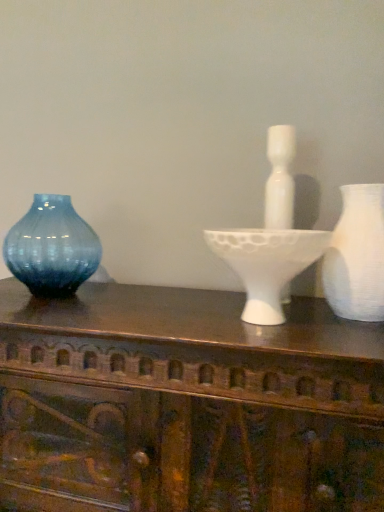
Question: Considering the relative sizes of white matte vase at right, which is counted as the 2th vase, starting from the left, and white matte candle holder at center in the image provided, is white matte vase at right, which is counted as the 2th vase, starting from the left, taller than white matte candle holder at center?

Choices:
 (A) no
 (B) yes

Answer: (B)

Question: Is white matte vase at right, the first vase when ordered from right to left, positioned beyond the bounds of white matte candle holder at center?

Choices:
 (A) yes
 (B) no

Answer: (A)

Question: Is white matte vase at right, the first vase when ordered from right to left, bigger than white matte candle holder at center?

Choices:
 (A) no
 (B) yes

Answer: (A)

Question: Is white matte vase at right, which ranks as the first vase in front-to-back order, shorter than white matte candle holder at center?

Choices:
 (A) yes
 (B) no

Answer: (B)

Question: Is white matte vase at right, which ranks as the first vase in front-to-back order, at the left side of white matte candle holder at center?

Choices:
 (A) yes
 (B) no

Answer: (B)

Question: Considering the relative positions of blue glass vase at left, which is the second vase in right-to-left order, and white matte vase at right, the first vase when ordered from right to left, in the image provided, is blue glass vase at left, which is the second vase in right-to-left order, to the left or to the right of white matte vase at right, the first vase when ordered from right to left,?

Choices:
 (A) left
 (B) right

Answer: (A)

Question: Looking at their shapes, would you say blue glass vase at left, positioned as the 2th vase in front-to-back order, is wider or thinner than white matte vase at right, which is counted as the 2th vase, starting from the left?

Choices:
 (A) wide
 (B) thin

Answer: (B)

Question: Do you think blue glass vase at left, positioned as the 2th vase in front-to-back order, is within white matte vase at right, the first vase when ordered from right to left, or outside of it?

Choices:
 (A) inside
 (B) outside

Answer: (B)

Question: From the image's perspective, is blue glass vase at left, the first vase viewed from the back, above or below white matte vase at right, which ranks as the first vase in front-to-back order?

Choices:
 (A) above
 (B) below

Answer: (A)

Question: Based on their sizes in the image, would you say wooden carved table at center is bigger or smaller than blue glass vase at left, which is the second vase in right-to-left order?

Choices:
 (A) big
 (B) small

Answer: (A)

Question: From the image's perspective, is wooden carved table at center located above or below blue glass vase at left, which is the second vase in right-to-left order?

Choices:
 (A) below
 (B) above

Answer: (A)

Question: From a real-world perspective, relative to blue glass vase at left, which is the second vase in right-to-left order, is wooden carved table at center vertically above or below?

Choices:
 (A) above
 (B) below

Answer: (B)

Question: Would you say wooden carved table at center is inside or outside blue glass vase at left, positioned as the 2th vase in front-to-back order?

Choices:
 (A) outside
 (B) inside

Answer: (A)

Question: Visually, is white matte vase at right, which is counted as the 2th vase, starting from the left, positioned to the left or to the right of blue glass vase at left, which is the second vase in right-to-left order?

Choices:
 (A) right
 (B) left

Answer: (A)

Question: In terms of height, does white matte vase at right, the first vase when ordered from right to left, look taller or shorter compared to blue glass vase at left, the first vase viewed from the back?

Choices:
 (A) tall
 (B) short

Answer: (B)